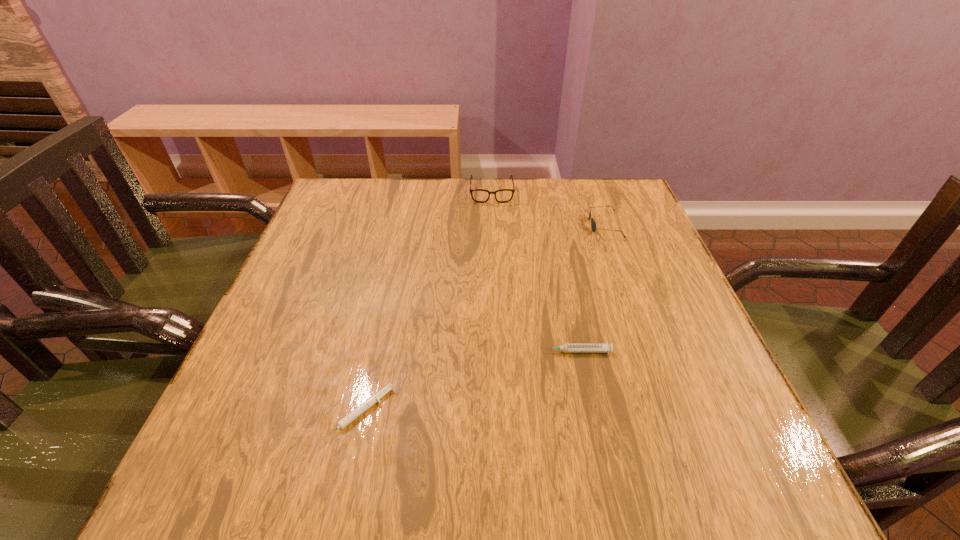
You are a GUI agent. You are given a task and a screenshot of the screen. Output one action in this format:
    pyautogui.click(x=<x>, y=<y>)
    Task: Click on the vacant area between the farthest object and the left syringe
    This screenshot has height=540, width=960.
    Given the screenshot: What is the action you would take?
    pyautogui.click(x=425, y=303)

Where is `empty space between the third object from right to left and the shortest object`? The width and height of the screenshot is (960, 540). empty space between the third object from right to left and the shortest object is located at coordinates (x=425, y=303).

You are a GUI agent. You are given a task and a screenshot of the screen. Output one action in this format:
    pyautogui.click(x=<x>, y=<y>)
    Task: Click on the vacant space that is in between the taller syringe and the shorter syringe
    This screenshot has height=540, width=960.
    Given the screenshot: What is the action you would take?
    pyautogui.click(x=468, y=383)

What are the coordinates of `free point between the spectacles and the left syringe` in the screenshot? It's located at (425, 303).

I want to click on vacant space in between the second object from left to right and the taller syringe, so click(534, 272).

At what (x,y) coordinates should I click in order to perform the action: click on vacant space that's between the nearer syringe and the taller syringe. Please return your answer as a coordinate pair (x, y). The height and width of the screenshot is (540, 960). Looking at the image, I should click on (468, 383).

The image size is (960, 540). I want to click on unoccupied area between the farther syringe and the nearer syringe, so click(468, 383).

The image size is (960, 540). Identify the location of blank region between the farther syringe and the leftmost object. (468, 383).

Choose which object is the second nearest neighbor to the farthest object. Please provide its 2D coordinates. Your answer should be formatted as a tuple, i.e. [(x, y)], where the tuple contains the x and y coordinates of a point satisfying the conditions above.

[(567, 348)]

Choose which object is the second nearest neighbor to the second tallest object. Please provide its 2D coordinates. Your answer should be formatted as a tuple, i.e. [(x, y)], where the tuple contains the x and y coordinates of a point satisfying the conditions above.

[(567, 348)]